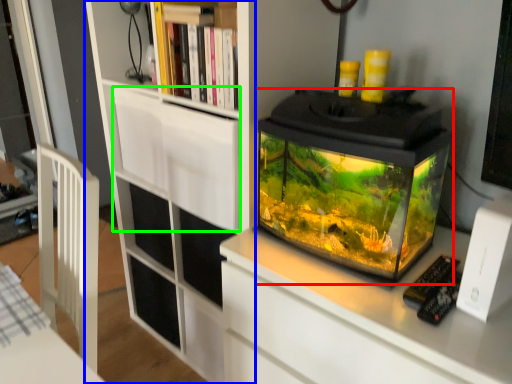
Question: Which is farther away from glass box (highlighted by a red box)? bookcase (highlighted by a blue box) or drawer (highlighted by a green box)?

Choices:
 (A) bookcase
 (B) drawer

Answer: (A)